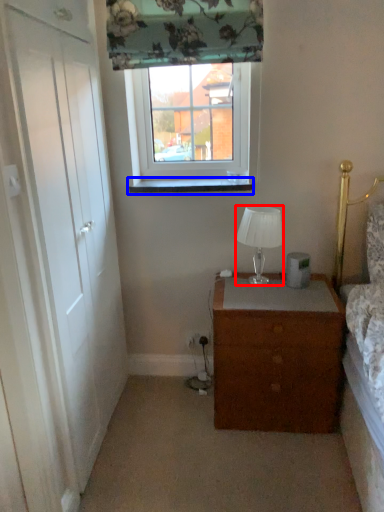
Question: Which of the following is the farthest to the observer, lamp (highlighted by a red box) or window sill (highlighted by a blue box)?

Choices:
 (A) lamp
 (B) window sill

Answer: (B)